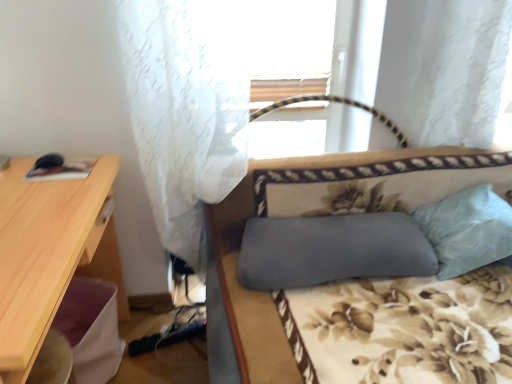
This screenshot has height=384, width=512. In order to click on vacant region above light wood desk at left (from a real-world perspective) in this screenshot , I will do `click(42, 202)`.